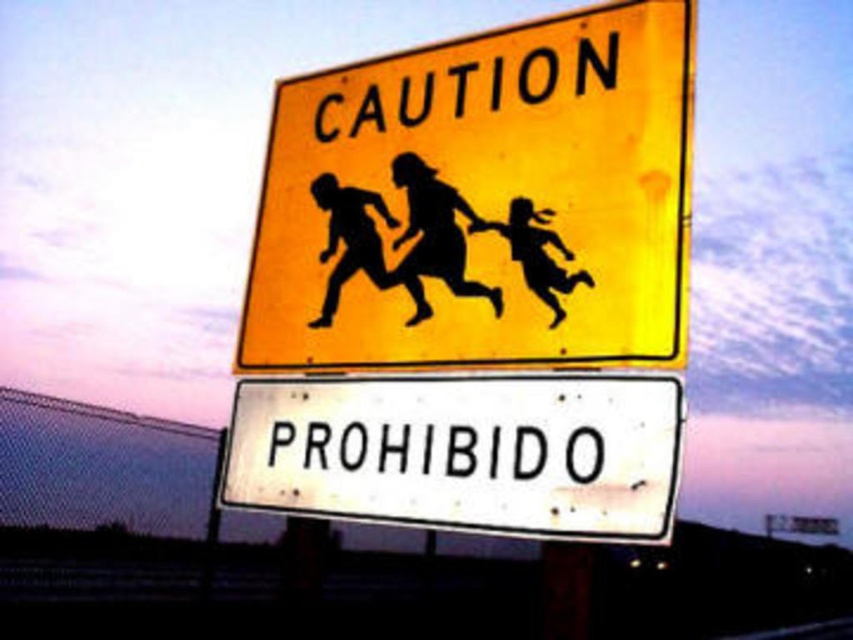
Is yellow matte caution sign at upper center taller than white matte sign at center?

Yes.

Is point (274, 321) positioned after point (265, 442)?

That is True.

This screenshot has width=853, height=640. I want to click on yellow matte caution sign at upper center, so click(x=482, y=202).